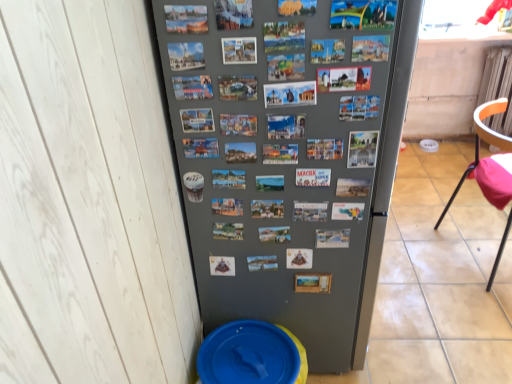
Question: Is blue plastic potty at lower left to the right of orange plastic chair at right from the viewer's perspective?

Choices:
 (A) no
 (B) yes

Answer: (A)

Question: Is orange plastic chair at right at the back of blue plastic potty at lower left?

Choices:
 (A) no
 (B) yes

Answer: (A)

Question: Does blue plastic potty at lower left have a larger size compared to orange plastic chair at right?

Choices:
 (A) no
 (B) yes

Answer: (A)

Question: Is blue plastic potty at lower left far away from orange plastic chair at right?

Choices:
 (A) no
 (B) yes

Answer: (B)

Question: From a real-world perspective, is blue plastic potty at lower left on top of orange plastic chair at right?

Choices:
 (A) yes
 (B) no

Answer: (B)

Question: Looking at their shapes, would you say blue plastic potty at lower left is wider or thinner than gray matte refrigerator at center?

Choices:
 (A) wide
 (B) thin

Answer: (B)

Question: Based on their positions, is blue plastic potty at lower left located to the left or right of gray matte refrigerator at center?

Choices:
 (A) left
 (B) right

Answer: (A)

Question: From the image's perspective, relative to gray matte refrigerator at center, is blue plastic potty at lower left above or below?

Choices:
 (A) above
 (B) below

Answer: (B)

Question: Considering the positions of blue plastic potty at lower left and gray matte refrigerator at center in the image, is blue plastic potty at lower left taller or shorter than gray matte refrigerator at center?

Choices:
 (A) short
 (B) tall

Answer: (A)

Question: Is point (474, 117) positioned closer to the camera than point (276, 380)?

Choices:
 (A) farther
 (B) closer

Answer: (A)

Question: Do you think orange plastic chair at right is within blue plastic potty at lower left, or outside of it?

Choices:
 (A) inside
 (B) outside

Answer: (B)

Question: From a real-world perspective, is orange plastic chair at right positioned above or below blue plastic potty at lower left?

Choices:
 (A) below
 (B) above

Answer: (B)

Question: Considering the positions of orange plastic chair at right and blue plastic potty at lower left in the image, is orange plastic chair at right bigger or smaller than blue plastic potty at lower left?

Choices:
 (A) small
 (B) big

Answer: (B)

Question: Is blue plastic potty at lower left inside or outside of orange plastic chair at right?

Choices:
 (A) outside
 (B) inside

Answer: (A)

Question: In terms of width, does blue plastic potty at lower left look wider or thinner when compared to orange plastic chair at right?

Choices:
 (A) thin
 (B) wide

Answer: (A)